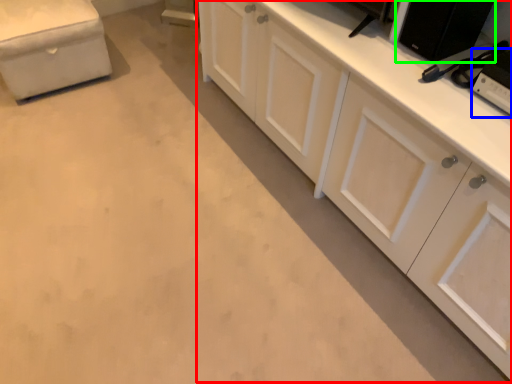
Question: Based on their relative distances, which object is nearer to cabinetry (highlighted by a red box)? Choose from appliance (highlighted by a blue box) and appliance (highlighted by a green box).

Choices:
 (A) appliance
 (B) appliance

Answer: (B)